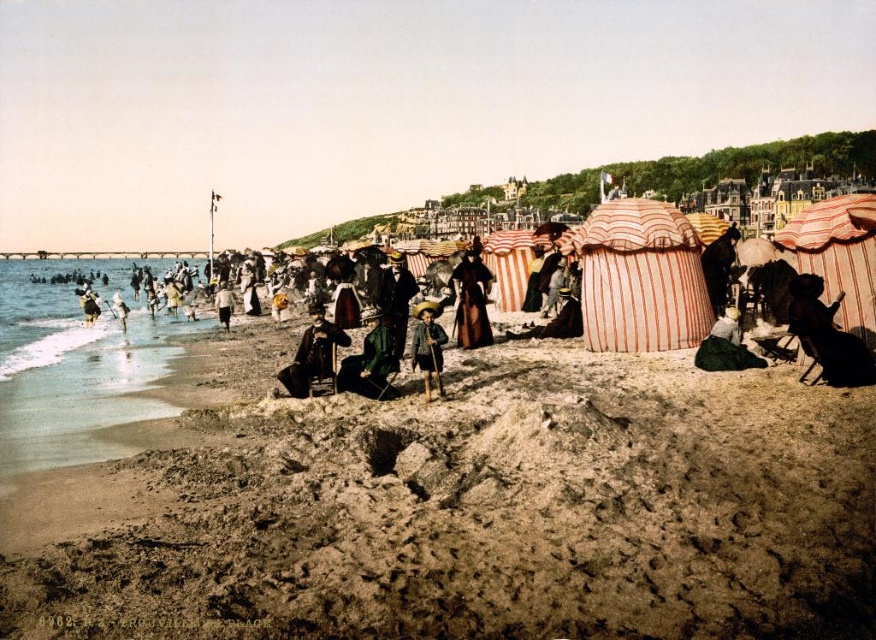
You are standing on the beach and see two points marked on the sand. The first point is at coordinates point (358, 371) and the second is at point (331, 326). Which point is closer to you?

Point (358, 371) is in front of point (331, 326), so it is closer to you.

You are a photographer standing on the beach and want to take a photo of the brown leather coat at center and the wooden stick at center. Since you want both objects in the same frame, do you think you can fit them in without moving your position? Please explain your reasoning based on their distance apart.

The brown leather coat at center and wooden stick at center are 57.42 feet apart. Given that the average camera lens can capture a field of view that accommodates such a distance when objects are in the same general area, it is feasible to include both in the frame without moving your position.